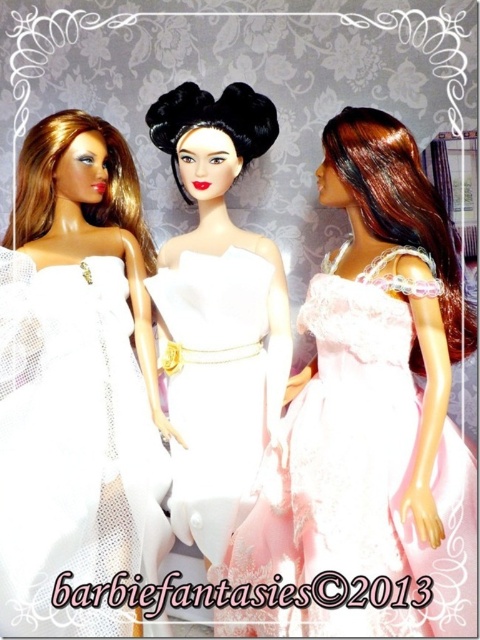
Which of these two, white mesh dress at center or white satin dress at center, stands taller?

With more height is white mesh dress at center.

Is white mesh dress at center further to camera compared to white satin dress at center?

No, it is in front of white satin dress at center.

Is point (80, 316) closer to viewer compared to point (169, 381)?

Yes, point (80, 316) is in front of point (169, 381).

Where is `white mesh dress at center`? Image resolution: width=480 pixels, height=640 pixels. white mesh dress at center is located at coordinates (72, 444).

Is pink lace dress at center thinner than white mesh dress at center?

In fact, pink lace dress at center might be wider than white mesh dress at center.

Locate an element on the screen. pink lace dress at center is located at coordinates (358, 474).

This screenshot has height=640, width=480. I want to click on pink lace dress at center, so click(x=358, y=474).

Between pink lace dress at center and white satin dress at center, which one appears on the left side from the viewer's perspective?

Positioned to the left is white satin dress at center.

Who is more forward, (382, 259) or (200, 454)?

Point (382, 259)

This screenshot has width=480, height=640. I want to click on pink lace dress at center, so click(358, 474).